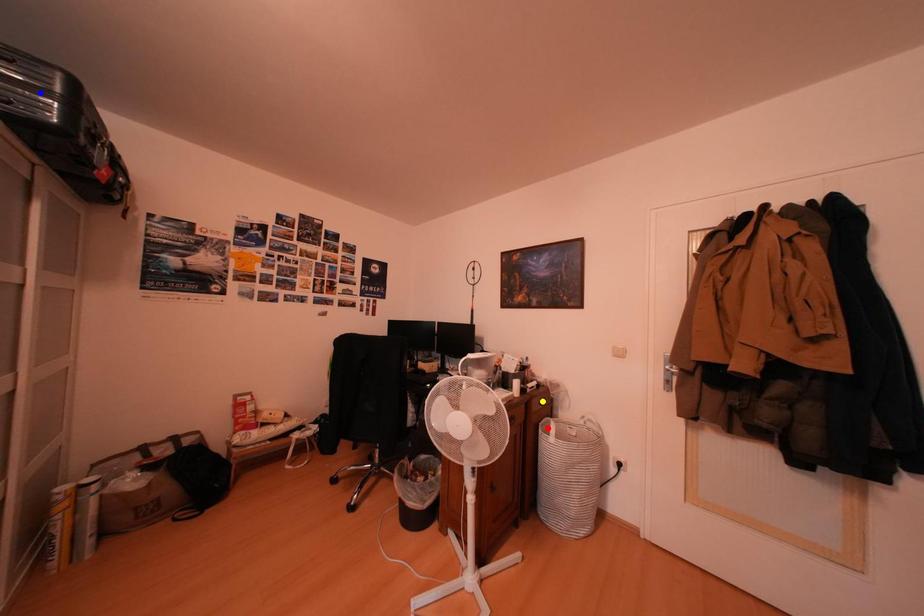
Order these from nearest to farthest:
red point
blue point
yellow point

blue point
red point
yellow point